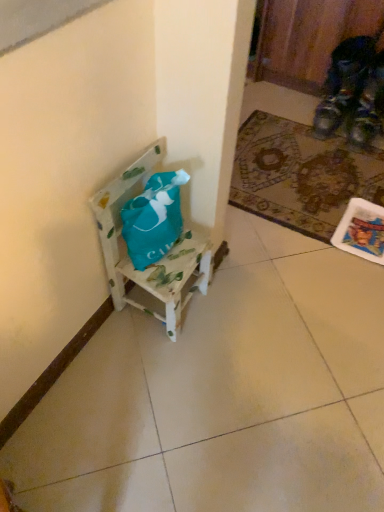
The width and height of the screenshot is (384, 512). What are the coordinates of `wooden painted chair at center` in the screenshot? It's located at (161, 259).

This screenshot has height=512, width=384. What do you see at coordinates (161, 259) in the screenshot?
I see `wooden painted chair at center` at bounding box center [161, 259].

Describe the element at coordinates (301, 174) in the screenshot. I see `patterned carpet at lower right` at that location.

Where is `patterned carpet at lower right`? patterned carpet at lower right is located at coordinates (301, 174).

In order to face patterned carpet at lower right, should I rotate leftwards or rightwards?

You should look right and rotate roughly 15.492 degrees.

Measure the distance between point (x=359, y=185) and camera.

Point (x=359, y=185) and camera are 5.63 feet apart from each other.

Identify the location of wooden painted chair at center. Image resolution: width=384 pixels, height=512 pixels. (161, 259).

Which is more to the right, wooden painted chair at center or patterned carpet at lower right?

patterned carpet at lower right is more to the right.

Is the depth of wooden painted chair at center greater than that of patterned carpet at lower right?

No, wooden painted chair at center is in front of patterned carpet at lower right.

Does point (125, 298) come farther from viewer compared to point (314, 189)?

That is False.

From the image's perspective, is wooden painted chair at center above or below patterned carpet at lower right?

wooden painted chair at center is below patterned carpet at lower right.

From a real-world perspective, is wooden painted chair at center located beneath patterned carpet at lower right?

Actually, wooden painted chair at center is physically above patterned carpet at lower right in the real world.

Between wooden painted chair at center and patterned carpet at lower right, which one has smaller width?

With smaller width is wooden painted chair at center.

Considering the relative sizes of wooden painted chair at center and patterned carpet at lower right in the image provided, is wooden painted chair at center shorter than patterned carpet at lower right?

No, wooden painted chair at center is not shorter than patterned carpet at lower right.

Between wooden painted chair at center and patterned carpet at lower right, which one has larger size?

Bigger between the two is wooden painted chair at center.

Is wooden painted chair at center situated inside patterned carpet at lower right or outside?

wooden painted chair at center lies outside patterned carpet at lower right.

Is wooden painted chair at center directly adjacent to patterned carpet at lower right?

They are not placed beside each other.

Is wooden painted chair at center looking in the opposite direction of patterned carpet at lower right?

wooden painted chair at center does not have its back to patterned carpet at lower right.

How different are the orientations of wooden painted chair at center and patterned carpet at lower right in degrees?

90 degrees.

Image resolution: width=384 pixels, height=512 pixels. I want to click on mat below the wooden painted chair at center (from a real-world perspective), so click(x=301, y=174).

Between patterned carpet at lower right and wooden painted chair at center, which one appears on the left side from the viewer's perspective?

wooden painted chair at center is more to the left.

Considering the relative positions of patterned carpet at lower right and wooden painted chair at center in the image provided, is patterned carpet at lower right in front of wooden painted chair at center?

No, patterned carpet at lower right is further to the viewer.

Based on the photo, which is further, (239, 191) or (129, 298)?

The point (239, 191) is more distant.

From the image's perspective, which is below, patterned carpet at lower right or wooden painted chair at center?

wooden painted chair at center appears lower in the image.

Consider the image. From a real-world perspective, between patterned carpet at lower right and wooden painted chair at center, who is vertically higher?

wooden painted chair at center, from a real-world perspective.

Is patterned carpet at lower right thinner than wooden painted chair at center?

No.

Which of these two, patterned carpet at lower right or wooden painted chair at center, stands shorter?

With less height is patterned carpet at lower right.

Between patterned carpet at lower right and wooden painted chair at center, which one has smaller size?

patterned carpet at lower right.

Is patterned carpet at lower right surrounding wooden painted chair at center?

Actually, wooden painted chair at center is outside patterned carpet at lower right.

Are patterned carpet at lower right and wooden painted chair at center far apart?

No.

Is patterned carpet at lower right turned away from wooden painted chair at center?

No.

How much distance is there between patterned carpet at lower right and wooden painted chair at center?

patterned carpet at lower right is 26.92 inches away from wooden painted chair at center.

Identify the location of mat on the right of wooden painted chair at center. The width and height of the screenshot is (384, 512). (301, 174).

Image resolution: width=384 pixels, height=512 pixels. In the image, there is a wooden painted chair at center. Identify the location of mat above it (from the image's perspective). click(301, 174).

What are the coordinates of `mat located on the right of wooden painted chair at center` in the screenshot? It's located at (301, 174).